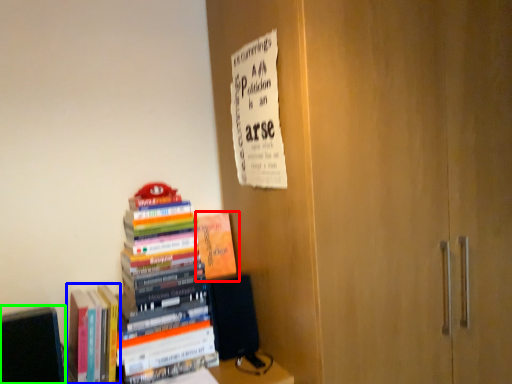
Question: Which object is the farthest from book (highlighted by a red box)? Choose among these: book (highlighted by a blue box) or book (highlighted by a green box).

Choices:
 (A) book
 (B) book

Answer: (B)